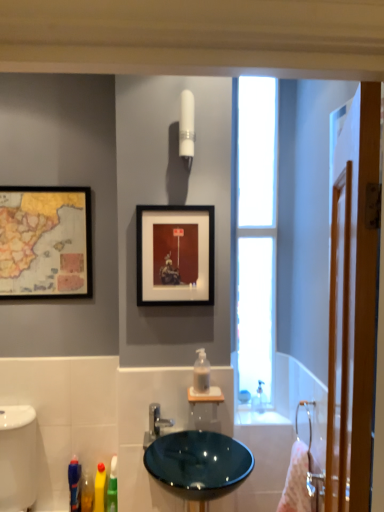
Question: Does point (292, 478) appear closer or farther from the camera than point (365, 472)?

Choices:
 (A) closer
 (B) farther

Answer: (B)

Question: Is pink fabric towel at right wider or thinner than wooden screen door at right?

Choices:
 (A) wide
 (B) thin

Answer: (A)

Question: Estimate the real-world distances between objects in this image. Which object is farther from the glossy ceramic sink at center?

Choices:
 (A) transparent glass window at right
 (B) translucent plastic soap dispenser at center
 (C) wooden-framed map at upper left, arranged as the second picture frame when viewed from the front
 (D) pink fabric towel at right
 (E) white glossy bidet at lower left

Answer: (C)

Question: Which of these objects is positioned closest to the glossy ceramic sink at center?

Choices:
 (A) black matte picture frame at upper center, arranged as the first picture frame when viewed from the right
 (B) wooden-framed map at upper left, arranged as the second picture frame when viewed from the front
 (C) satin nickel faucet at center
 (D) wooden screen door at right
 (E) pink fabric towel at right

Answer: (C)